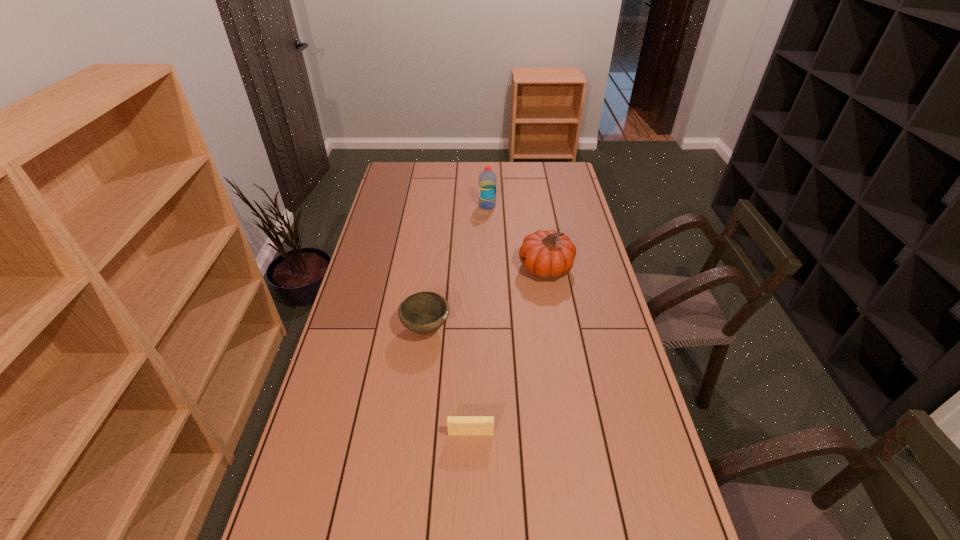
This screenshot has width=960, height=540. Identify the location of free spot located 0.090m on the face of the rightmost object. (494, 268).

The width and height of the screenshot is (960, 540). In order to click on vacant space located on the face of the rightmost object in this screenshot , I will do `click(423, 268)`.

At what (x,y) coordinates should I click in order to perform the action: click on vacant space located on the face of the rightmost object. Please return your answer as a coordinate pair (x, y). The height and width of the screenshot is (540, 960). Looking at the image, I should click on (455, 268).

Find the location of `free space located 0.340m on the front of the third farthest object`. free space located 0.340m on the front of the third farthest object is located at coordinates (411, 450).

At what (x,y) coordinates should I click in order to perform the action: click on free location located 0.140m at the front of the videotape with spools. Please return your answer as a coordinate pair (x, y). The height and width of the screenshot is (540, 960). Looking at the image, I should click on (470, 491).

At what (x,y) coordinates should I click in order to perform the action: click on object that is at the right edge. Please return your answer as a coordinate pair (x, y). This screenshot has height=540, width=960. Looking at the image, I should click on (547, 254).

The image size is (960, 540). Identify the location of free point at the far edge. (464, 185).

In the image, there is a desktop. Identify the location of free space at the left edge. (365, 291).

Where is `vacant space at the right edge of the desktop`? The height and width of the screenshot is (540, 960). vacant space at the right edge of the desktop is located at coordinates (582, 256).

Where is `free region at the far left corner of the desktop`? The height and width of the screenshot is (540, 960). free region at the far left corner of the desktop is located at coordinates (415, 180).